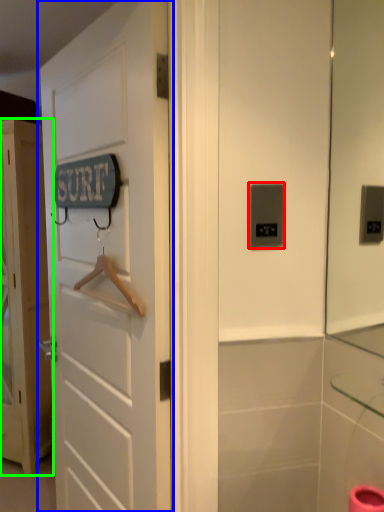
Question: Based on their relative distances, which object is nearer to light switch (highlighted by a red box)? Choose from door (highlighted by a blue box) and door (highlighted by a green box).

Choices:
 (A) door
 (B) door

Answer: (A)